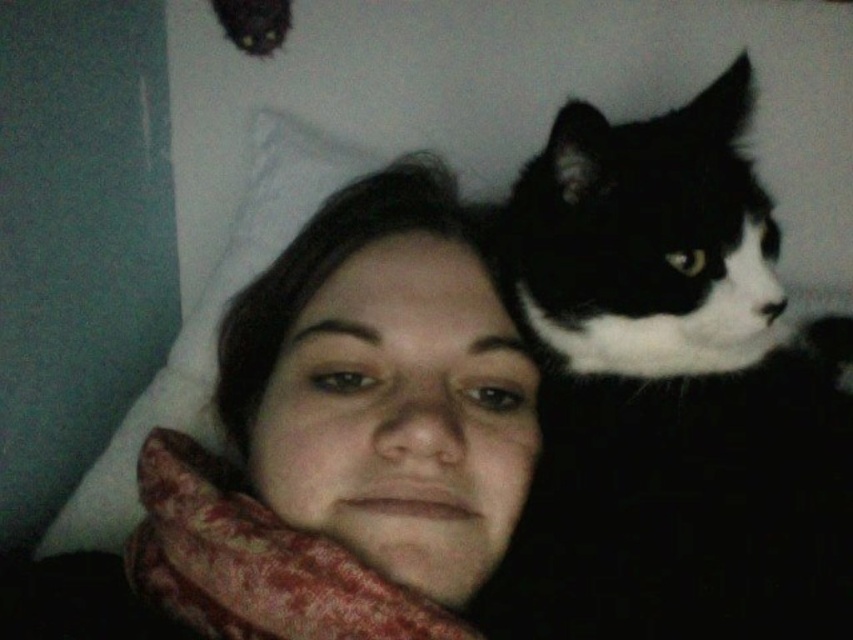
You are a photographer trying to capture a close shot of the black and white fur at upper right and the white soft pillow at upper left. Which object is positioned closer to the camera?

The black and white fur at upper right is closer to the camera than the white soft pillow at upper left.

You are a photographer setting up a shot. You have a black and white fur at upper right and a white soft pillow at upper left in your frame. Which object should you adjust to make them appear the same size in the photo?

Since the black and white fur at upper right is smaller than the white soft pillow at upper left, you should move the black and white fur at upper right closer to the camera to increase its size in the frame.

You are a photographer trying to capture a portrait of the person and the cat. The camera is set up to focus on the person first. Since the black and white fur at upper right and the white soft pillow at upper left are in the background, which one is closer to the camera?

The black and white fur at upper right is positioned on the right side of the white soft pillow at upper left, so the white soft pillow at upper left is closer to the camera than the black and white fur at upper right.